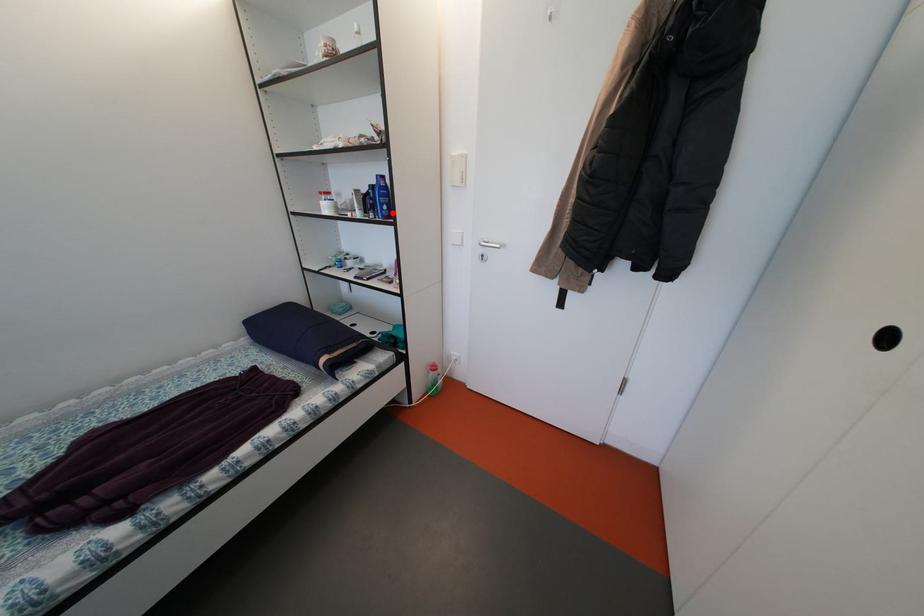
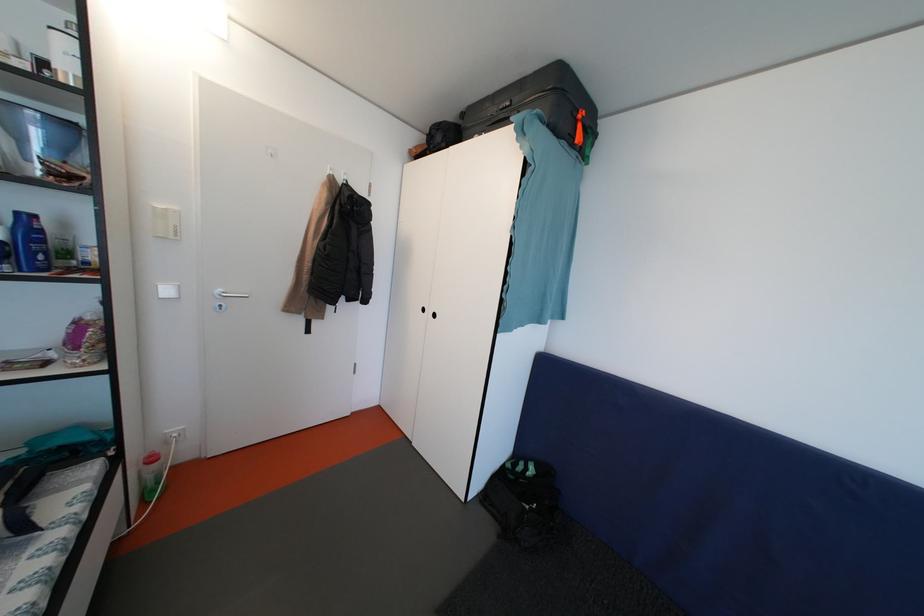
Find the pixel in the second image that matches the highlighted location in the first image.

(49, 262)